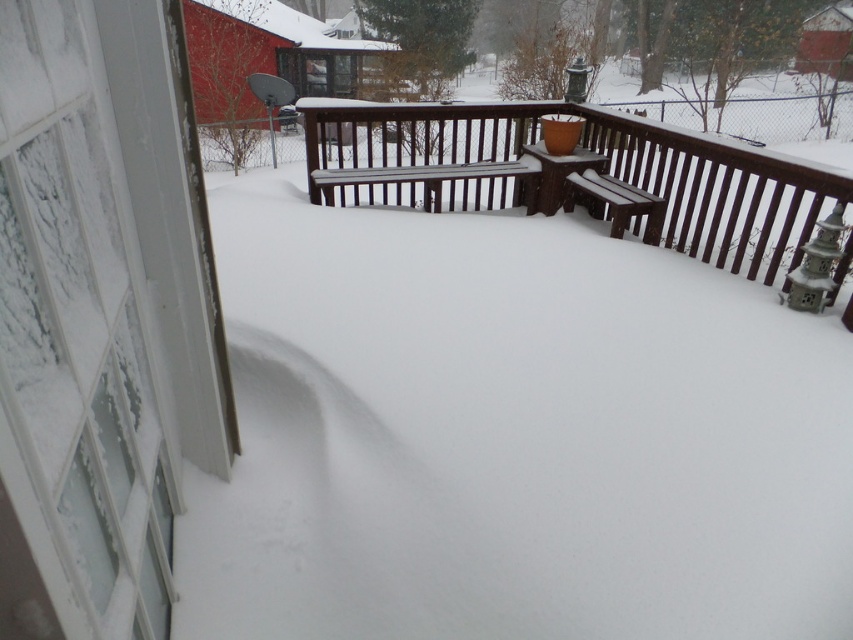
You are a guest at this house and need to sit down. The brown wood bench at center and the brown wooden bench at right are both available. Which bench is taller?

The brown wood bench at center is taller than the brown wooden bench at right.

You are planning to place a large winter coat on one of the benches. Which bench, the brown wood bench at center or the brown wooden bench at right, is more likely to have enough space for the coat without it hanging off the edge?

The brown wood bench at center is more likely to have enough space for the coat without it hanging off the edge because it might be wider than the brown wooden bench at right.

You are standing inside the house looking out the window. There are two points marked on the snow outside. The first point is at coordinate (x=820, y=192) and the second is at (x=596, y=189). Which point is closer to you?

Point (x=820, y=192) is closer to the camera than point (x=596, y=189).